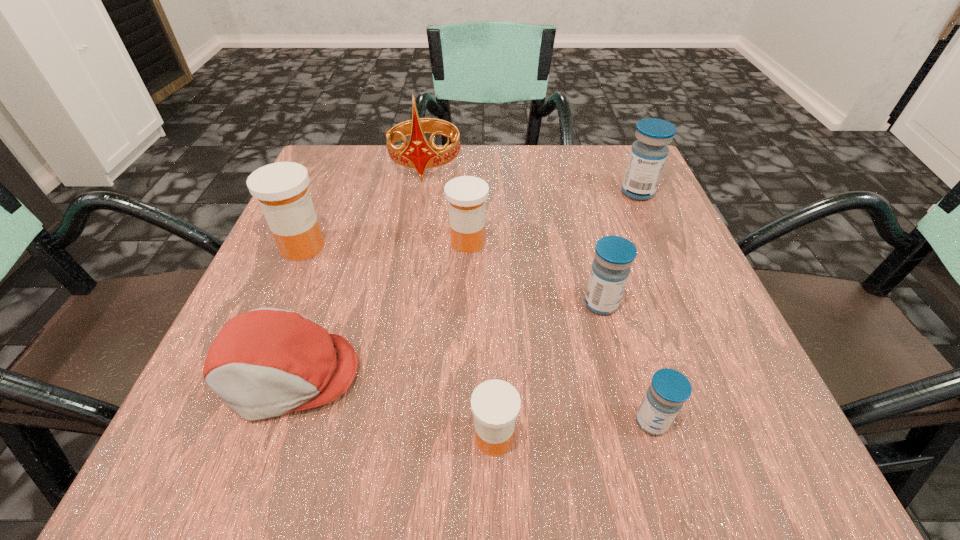
You are a GUI agent. You are given a task and a screenshot of the screen. Output one action in this format:
    pyautogui.click(x=<x>, y=<y>)
    Task: Click on the tallest object
    The width and height of the screenshot is (960, 540).
    Given the screenshot: What is the action you would take?
    pyautogui.click(x=420, y=154)

Image resolution: width=960 pixels, height=540 pixels. Identify the location of red tiara. (420, 154).

This screenshot has height=540, width=960. Identify the location of the rightmost blue medicine. (648, 155).

Image resolution: width=960 pixels, height=540 pixels. I want to click on the farthest blue medicine, so click(x=648, y=155).

I want to click on the leftmost orange medicine, so click(281, 188).

What are the coordinates of `the biggest orange medicine` in the screenshot? It's located at (281, 188).

Where is `the second biggest orange medicine`? the second biggest orange medicine is located at coordinates (466, 195).

Where is `the fifth farthest object`? The width and height of the screenshot is (960, 540). the fifth farthest object is located at coordinates (614, 255).

What are the coordinates of `the second farthest blue medicine` in the screenshot? It's located at (614, 255).

Find the location of `red cap`. red cap is located at coordinates (266, 362).